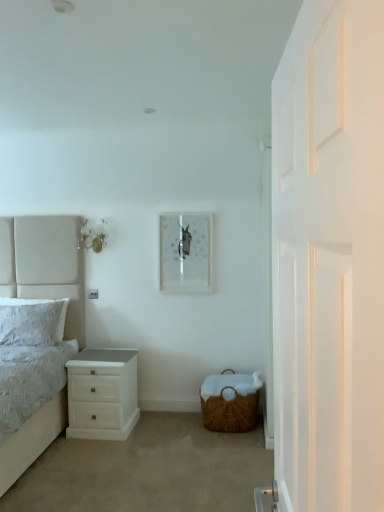
You are a GUI agent. You are given a task and a screenshot of the screen. Output one action in this format:
    pyautogui.click(x=<x>, y=<y>)
    Task: Click on the vacant region in front of white glossy chest of drawers at lower left
    This screenshot has height=512, width=384.
    Given the screenshot: What is the action you would take?
    pyautogui.click(x=94, y=449)